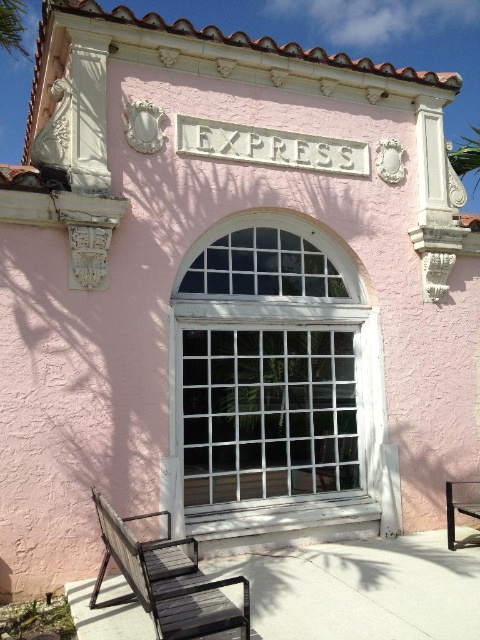
Question: Based on their relative distances, which object is nearer to the wooden bench at lower right?

Choices:
 (A) wooden park bench at lower left
 (B) white glass window at center

Answer: (B)

Question: Does white glass window at center have a greater width compared to wooden park bench at lower left?

Choices:
 (A) no
 (B) yes

Answer: (B)

Question: Which object is farther from the camera taking this photo?

Choices:
 (A) wooden park bench at lower left
 (B) wooden bench at lower right

Answer: (B)

Question: Which point is farther from the camera taking this photo?

Choices:
 (A) (446, 532)
 (B) (285, 364)
 (C) (236, 580)

Answer: (A)

Question: In this image, where is wooden park bench at lower left located relative to wooden bench at lower right?

Choices:
 (A) above
 (B) below

Answer: (A)

Question: Is white glass window at center closer to camera compared to wooden park bench at lower left?

Choices:
 (A) no
 (B) yes

Answer: (A)